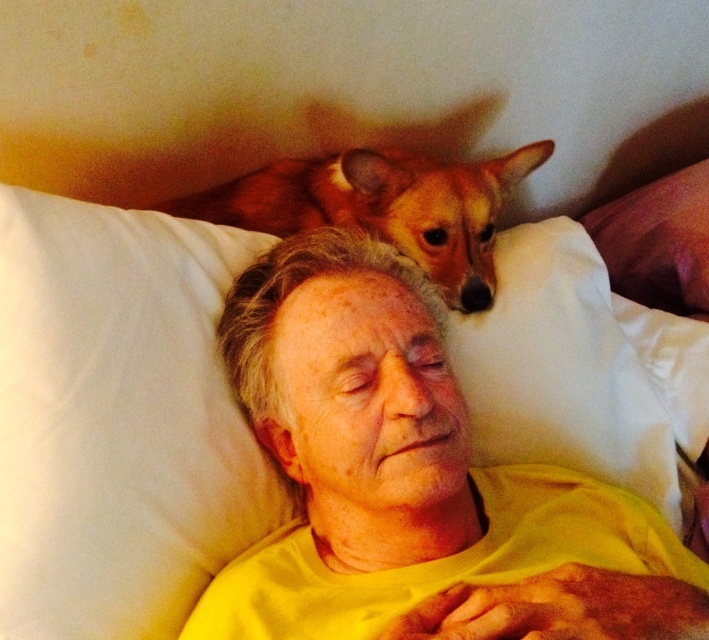
Can you confirm if white soft pillow at upper left is bigger than brown fur dog at upper center?

Incorrect, white soft pillow at upper left is not larger than brown fur dog at upper center.

Who is more forward, (x=125, y=460) or (x=201, y=216)?

Point (x=125, y=460) is more forward.

Between point (45, 588) and point (501, 177), which one is positioned behind?

Positioned behind is point (501, 177).

Image resolution: width=709 pixels, height=640 pixels. In order to click on white soft pillow at upper left in this screenshot , I will do `click(118, 419)`.

Is point (393, 316) less distant than point (67, 572)?

No, (393, 316) is behind (67, 572).

Does point (623, 604) come in front of point (16, 484)?

Yes, it is in front of point (16, 484).

Find the location of `yellow matte shirt at center`. yellow matte shirt at center is located at coordinates 413,481.

Does yellow matte shirt at center have a larger size compared to white soft pillow at upper center?

Correct, yellow matte shirt at center is larger in size than white soft pillow at upper center.

Measure the distance between yellow matte shirt at center and camera.

A distance of 21.70 inches exists between yellow matte shirt at center and camera.

Identify the location of yellow matte shirt at center. (413, 481).